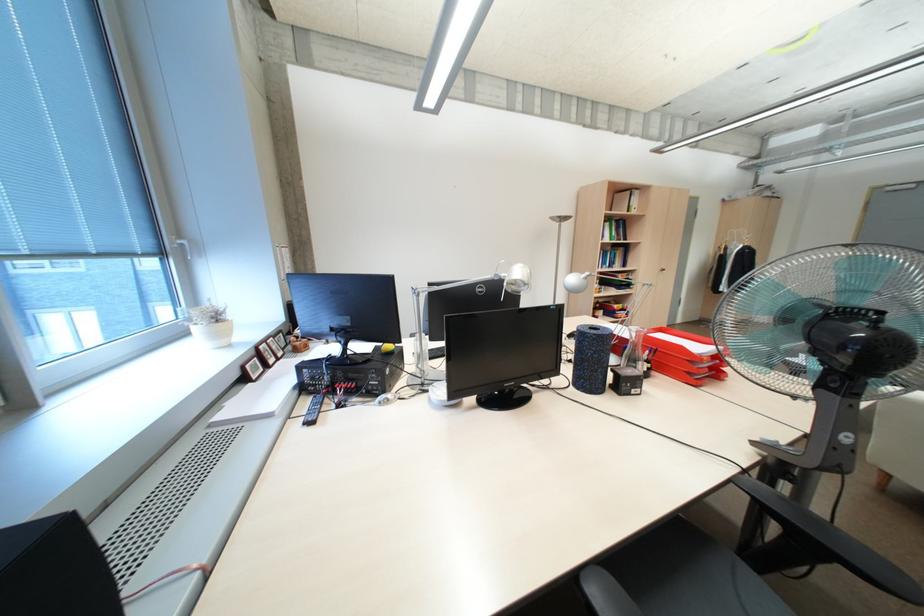
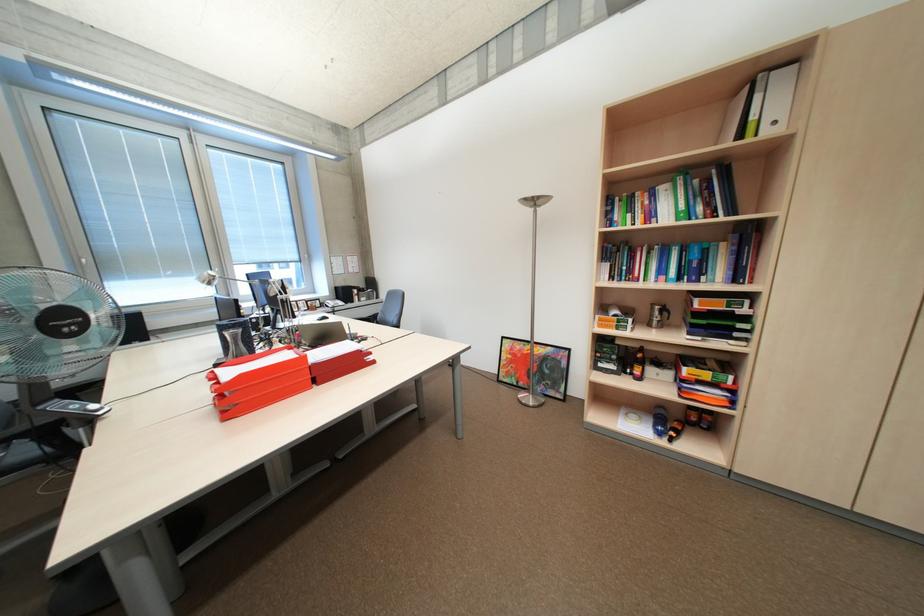
The point at (612, 236) is marked in the first image. Where is the corresponding point in the second image?

(661, 215)